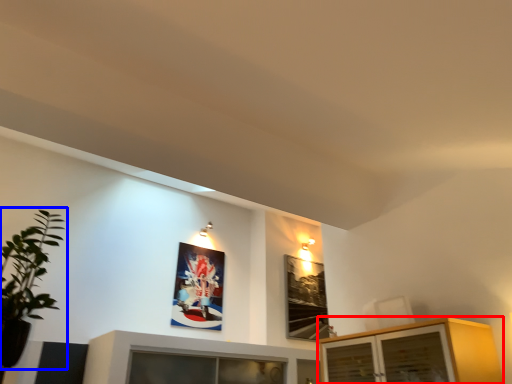
Question: Which of the following is the farthest to the observer, cabinetry (highlighted by a red box) or houseplant (highlighted by a blue box)?

Choices:
 (A) cabinetry
 (B) houseplant

Answer: (A)